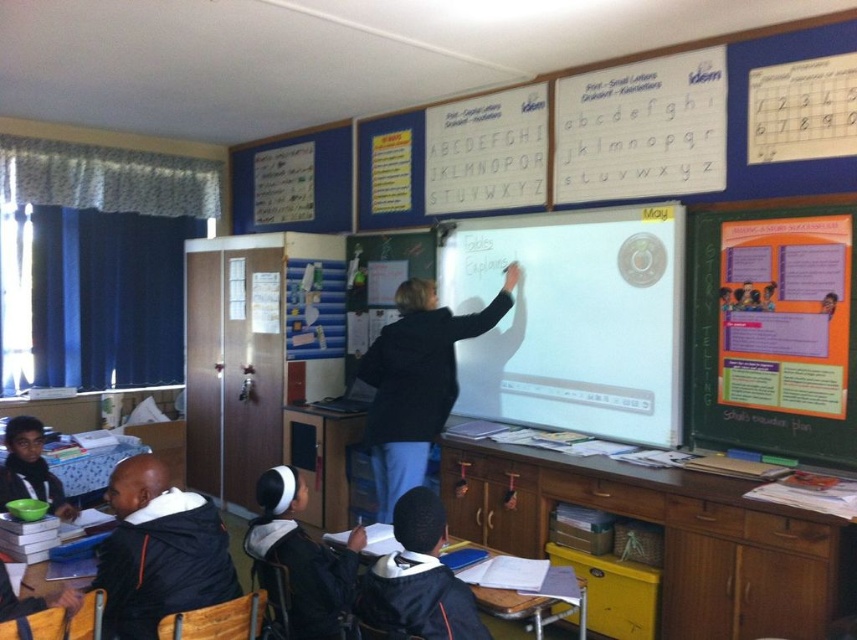
You are a student sitting at the desk closest to the window. You want to reach the orange paper poster at right to take a closer look. If your desk is 3 meters away from the camera, can you comfortably walk from your desk to the poster without needing to move any furniture?

The orange paper poster at right is 2.99 meters away from the camera, and your desk is 3 meters away. Since the distance from your desk to the poster would be approximately 0.01 meters, you can comfortably reach it without moving any furniture.

You are a student in the classroom and want to compare the sizes of the orange paper poster at right and the black jacket at lower left. Which one has a greater width?

The orange paper poster at right has a greater width than the black jacket at lower left.

Where is the black jacket at lower left located in the classroom?

The black jacket at lower left is located at point (x=159, y=552) in the classroom.